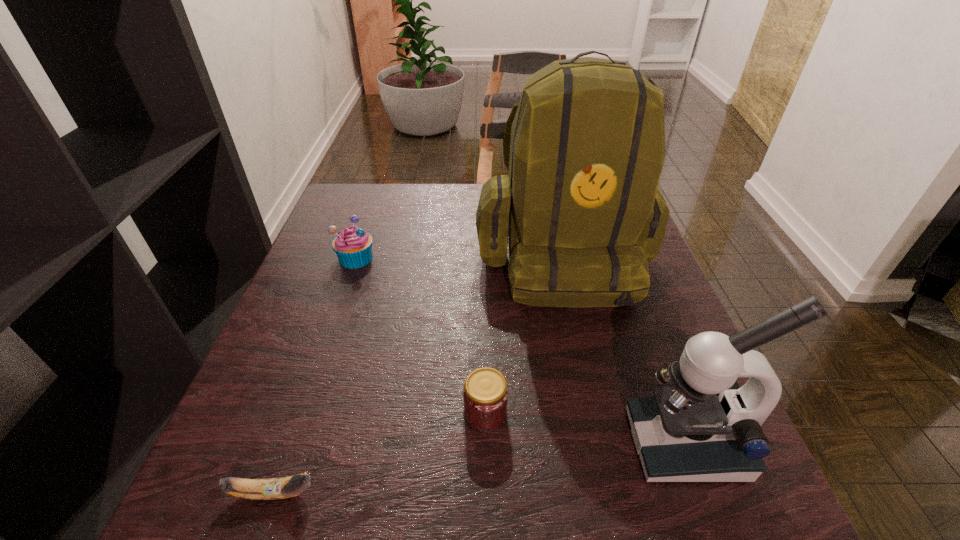
At what (x,y) coordinates should I click in order to perform the action: click on object located in the far edge section of the desktop. Please return your answer as a coordinate pair (x, y). Looking at the image, I should click on (581, 213).

Image resolution: width=960 pixels, height=540 pixels. Find the location of `microscope at the near edge`. microscope at the near edge is located at coordinates (705, 428).

You are a GUI agent. You are given a task and a screenshot of the screen. Output one action in this format:
    pyautogui.click(x=<x>, y=<y>)
    Task: Click on the banana that is positioned at the near edge
    The width and height of the screenshot is (960, 540).
    Given the screenshot: What is the action you would take?
    pyautogui.click(x=274, y=488)

Where is `muffin present at the left edge`? muffin present at the left edge is located at coordinates (353, 245).

Where is `banana located at the left edge`? The image size is (960, 540). banana located at the left edge is located at coordinates (274, 488).

At what (x,y) coordinates should I click in order to perform the action: click on backpack positioned at the right edge. Please return your answer as a coordinate pair (x, y). Image resolution: width=960 pixels, height=540 pixels. Looking at the image, I should click on (581, 213).

Where is `microscope located at the right edge`? microscope located at the right edge is located at coordinates (705, 428).

What are the coordinates of `object that is at the near left corner` in the screenshot? It's located at (274, 488).

This screenshot has width=960, height=540. Identify the location of object that is at the far right corner. (581, 213).

This screenshot has height=540, width=960. Identify the location of object situated at the near right corner. (705, 428).